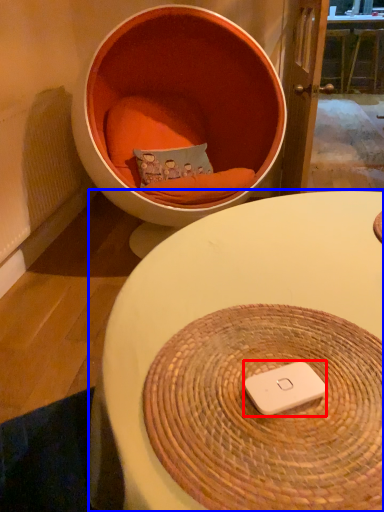
Question: Which object appears farthest to the camera in this image, ipod (highlighted by a red box) or table (highlighted by a blue box)?

Choices:
 (A) ipod
 (B) table

Answer: (A)